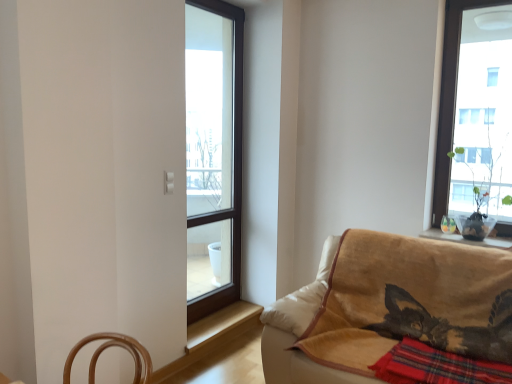
Question: Does velvet beige couch at lower right lie in front of red plaid blanket at lower right?

Choices:
 (A) no
 (B) yes

Answer: (B)

Question: From a real-world perspective, is velvet beige couch at lower right on red plaid blanket at lower right?

Choices:
 (A) no
 (B) yes

Answer: (A)

Question: Is velvet beige couch at lower right in contact with red plaid blanket at lower right?

Choices:
 (A) yes
 (B) no

Answer: (B)

Question: Can you confirm if velvet beige couch at lower right is thinner than red plaid blanket at lower right?

Choices:
 (A) no
 (B) yes

Answer: (A)

Question: From a real-world perspective, is velvet beige couch at lower right located beneath red plaid blanket at lower right?

Choices:
 (A) yes
 (B) no

Answer: (A)

Question: Is velvet beige couch at lower right positioned far away from red plaid blanket at lower right?

Choices:
 (A) yes
 (B) no

Answer: (B)

Question: From a real-world perspective, is red plaid blanket at lower right located higher than transparent glass window at center?

Choices:
 (A) no
 (B) yes

Answer: (A)

Question: Can you confirm if red plaid blanket at lower right is shorter than transparent glass window at center?

Choices:
 (A) no
 (B) yes

Answer: (B)

Question: Is red plaid blanket at lower right to the right of transparent glass window at center from the viewer's perspective?

Choices:
 (A) no
 (B) yes

Answer: (B)

Question: Is the surface of red plaid blanket at lower right in direct contact with transparent glass window at center?

Choices:
 (A) yes
 (B) no

Answer: (B)

Question: Could transparent glass window at center be considered to be inside red plaid blanket at lower right?

Choices:
 (A) no
 (B) yes

Answer: (A)

Question: Is red plaid blanket at lower right positioned with its back to transparent glass window at center?

Choices:
 (A) no
 (B) yes

Answer: (A)

Question: From a real-world perspective, does wooden at lower center sit lower than red plaid blanket at lower right?

Choices:
 (A) no
 (B) yes

Answer: (B)